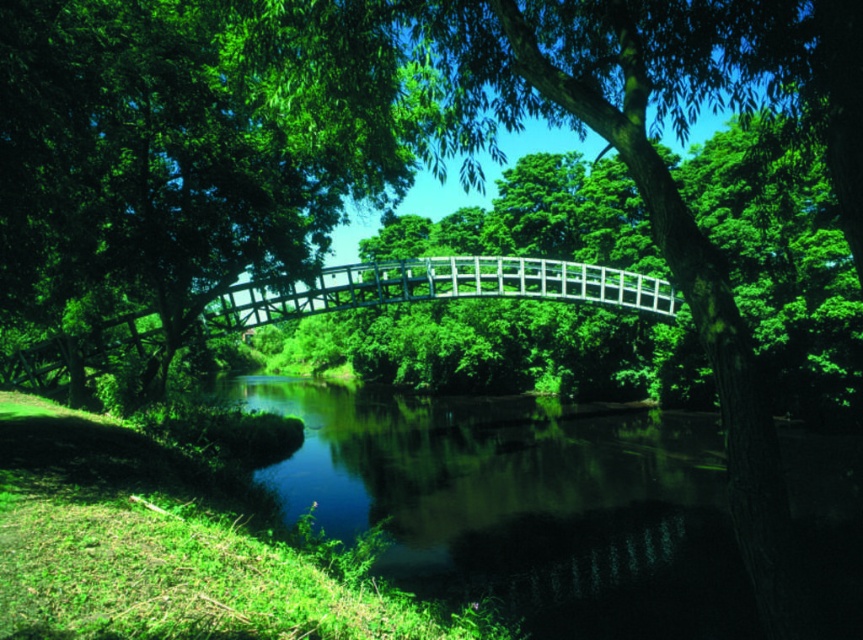
Does green reflective water at center have a lesser height compared to white wooden bridge at center?

Yes.

Can you confirm if green reflective water at center is positioned to the left of white wooden bridge at center?

No, green reflective water at center is not to the left of white wooden bridge at center.

Is point (375, 416) more distant than point (662, 296)?

Yes, point (375, 416) is behind point (662, 296).

You are a GUI agent. You are given a task and a screenshot of the screen. Output one action in this format:
    pyautogui.click(x=<x>, y=<y>)
    Task: Click on the green reflective water at center
    
    Given the screenshot: What is the action you would take?
    pyautogui.click(x=523, y=502)